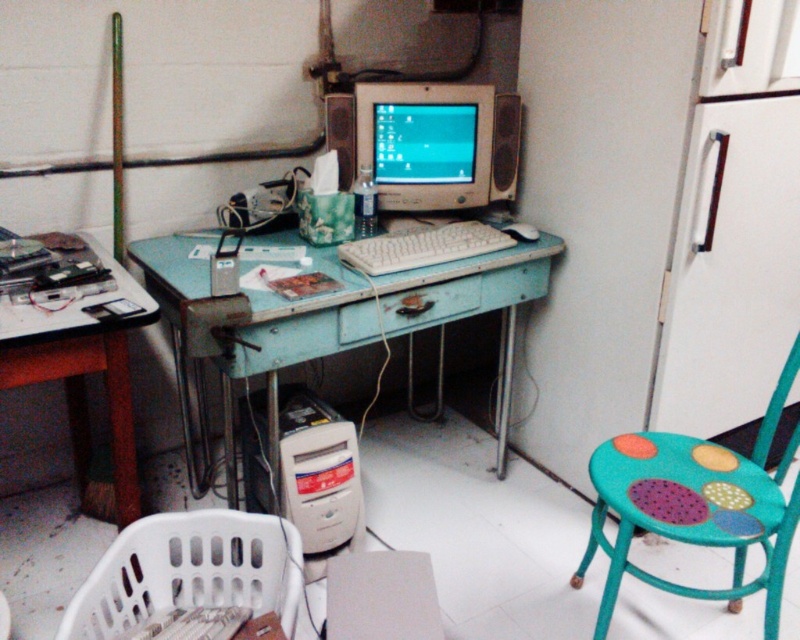
The width and height of the screenshot is (800, 640). What do you see at coordinates (189, 572) in the screenshot?
I see `white plastic laundry basket at lower left` at bounding box center [189, 572].

Between white plastic laundry basket at lower left and matte plastic monitor at center, which one appears on the right side from the viewer's perspective?

matte plastic monitor at center is more to the right.

Does point (128, 552) come closer to viewer compared to point (394, 83)?

That is True.

You are a GUI agent. You are given a task and a screenshot of the screen. Output one action in this format:
    pyautogui.click(x=<x>, y=<y>)
    Task: Click on the white plastic laundry basket at lower left
    This screenshot has height=640, width=800.
    Given the screenshot: What is the action you would take?
    pyautogui.click(x=189, y=572)

Can you confirm if teal painted wood desk at center is positioned to the right of white plastic keyboard at center?

No, teal painted wood desk at center is not to the right of white plastic keyboard at center.

Which is above, teal painted wood desk at center or white plastic keyboard at center?

white plastic keyboard at center is higher up.

Is point (254, 305) farther from viewer compared to point (348, 260)?

No, (254, 305) is closer to viewer.

At what (x,y) coordinates should I click in order to perform the action: click on teal painted wood desk at center. Please return your answer as a coordinate pair (x, y). The height and width of the screenshot is (640, 800). Looking at the image, I should click on (328, 316).

Image resolution: width=800 pixels, height=640 pixels. What do you see at coordinates (696, 506) in the screenshot?
I see `teal painted wood stool at right` at bounding box center [696, 506].

Is point (796, 499) less distant than point (409, 262)?

That is True.

Identify the location of teal painted wood stool at right. This screenshot has height=640, width=800. (696, 506).

Image resolution: width=800 pixels, height=640 pixels. I want to click on teal painted wood stool at right, so click(x=696, y=506).